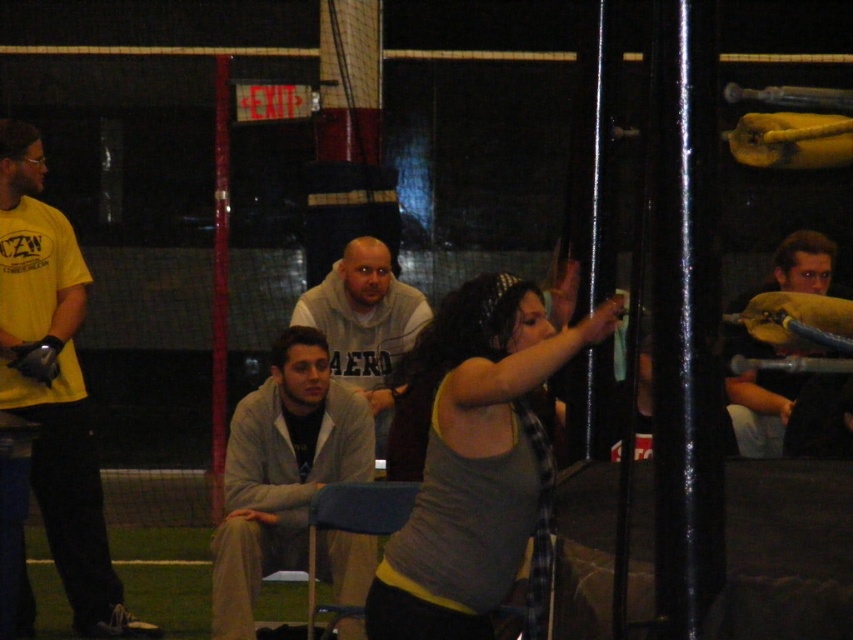
Can you confirm if gray tank top at center is smaller than light gray sweater at center?

Indeed, gray tank top at center has a smaller size compared to light gray sweater at center.

At what (x,y) coordinates should I click in order to perform the action: click on gray tank top at center. Please return your answer as a coordinate pair (x, y). Looking at the image, I should click on (479, 464).

Can you confirm if gray tank top at center is positioned to the left of yellow matte shirt at left?

No, gray tank top at center is not to the left of yellow matte shirt at left.

Can you confirm if gray tank top at center is positioned above yellow matte shirt at left?

Actually, gray tank top at center is below yellow matte shirt at left.

Is point (410, 624) in front of point (35, 486)?

Yes, it is.

Find the location of a particular element. gray tank top at center is located at coordinates (479, 464).

Which of these two, yellow matte shirt at left or yellow fabric pillow at right, stands taller?

With more height is yellow matte shirt at left.

Which is behind, point (90, 416) or point (775, 436)?

The point (775, 436) is more distant.

Find the location of `yellow matte shirt at left`. yellow matte shirt at left is located at coordinates (54, 384).